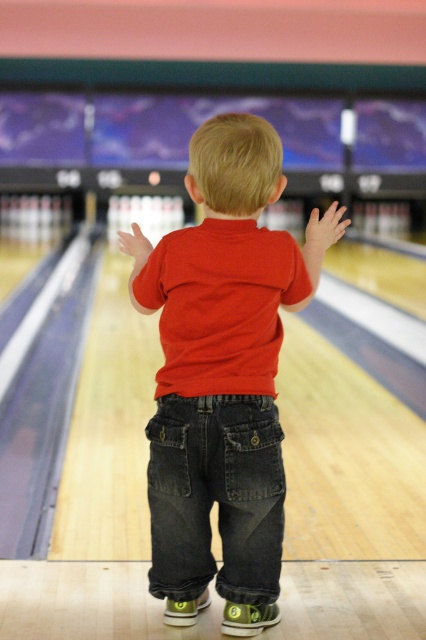
The child is wearing a red cotton shirt at center and dark blue denim jeans at center. Which clothing item is wider?

The red cotton shirt at center is wider than the dark blue denim jeans at center.

You are a photographer standing at the end of the bowling lane, and you want to take a closeup shot of the red cotton shirt at center. The camera you are using has a minimum focusing distance of 2 meters. Can you take the photo without moving closer?

The red cotton shirt at center is 2.55 meters away from camera, so yes, the photographer can take the photo without moving closer because the distance is within the camera minimum focusing distance of 2 meters.